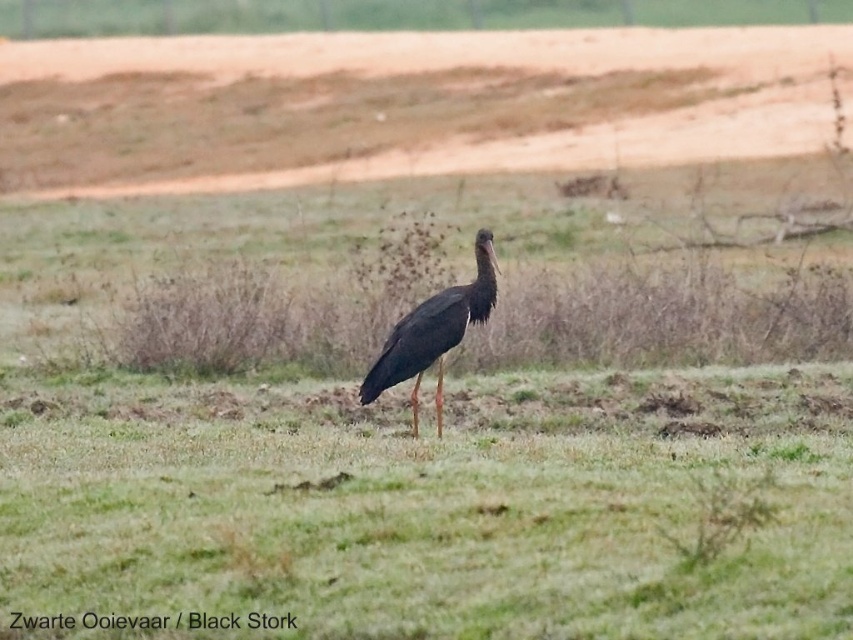
You are a photographer trying to capture the Black Stork in the grassy field. You have two markers placed at point coordinates point (x=421, y=104) and point (x=364, y=388). Which marker is closer to the camera?

Point (x=364, y=388) is closer to the camera because the description states that point (x=421, y=104) is further away than point (x=364, y=388).

You are a birdwatcher observing the Black Stork in the grassy field. You notice a point marked at coordinates (x=405, y=104). What is located at that specific point?

At point (x=405, y=104) lies brown sandy dirt at upper center.

You are a photographer trying to capture the matte black stork at center in your shot. You want to ensure the brown sandy dirt at upper center doesn

The brown sandy dirt at upper center is larger in size than the matte black stork at center, so it will occupy more space in the frame. To focus on the stork, you might need to adjust your angle or zoom in to reduce the prominence of the dirt area.